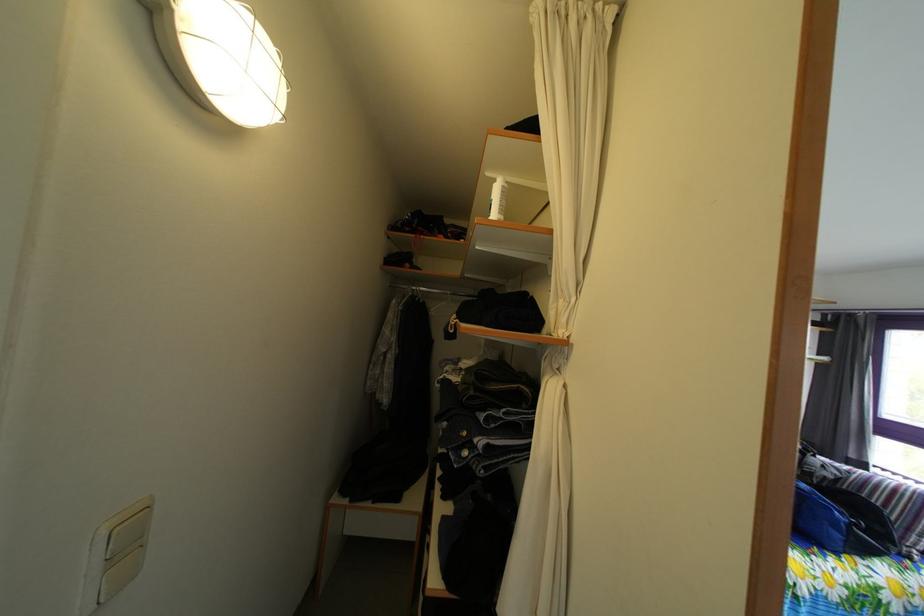
This screenshot has height=616, width=924. What are the coordinates of `clothes hanger hook` in the screenshot? It's located at click(406, 290).